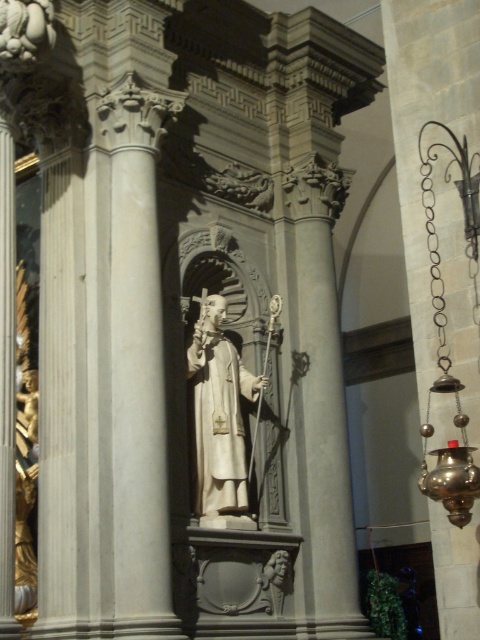
Who is positioned more to the left, polished brass candle holder at right or white marble statue at center?

white marble statue at center is more to the left.

Is polished brass candle holder at right above white marble statue at center?

Correct, polished brass candle holder at right is located above white marble statue at center.

This screenshot has width=480, height=640. What do you see at coordinates (422, 122) in the screenshot? I see `polished brass candle holder at right` at bounding box center [422, 122].

The height and width of the screenshot is (640, 480). I want to click on polished brass candle holder at right, so click(x=422, y=122).